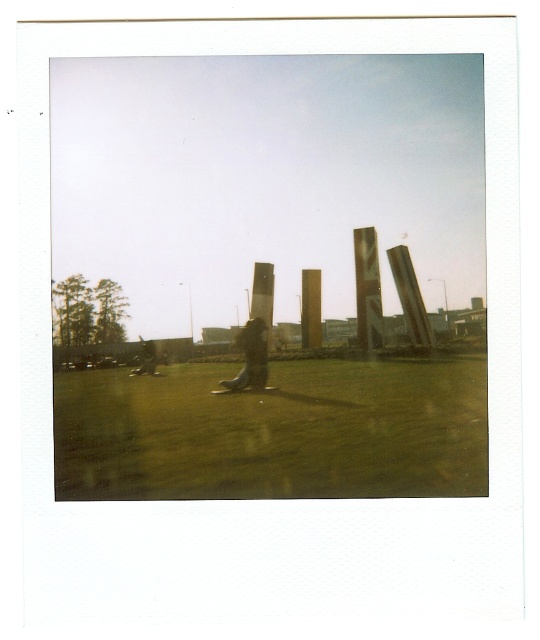
Question: Which point is farther from the camera taking this photo?

Choices:
 (A) (380, 314)
 (B) (315, 280)
 (C) (151, 340)
 (D) (192, 410)

Answer: (C)

Question: Can you confirm if leather boots at center is positioned above gold polished pillar at center?

Choices:
 (A) yes
 (B) no

Answer: (B)

Question: Considering the relative positions of bronze textured pillar at center and matte black jacket at lower left in the image provided, where is bronze textured pillar at center located with respect to matte black jacket at lower left?

Choices:
 (A) right
 (B) left

Answer: (A)

Question: Among these objects, which one is farthest from the camera?

Choices:
 (A) bronze textured pillar at center
 (B) leather boots at center
 (C) gold polished pillar at center

Answer: (C)

Question: Observing the image, what is the correct spatial positioning of green grass at center in reference to gold polished pillar at center?

Choices:
 (A) right
 (B) left

Answer: (B)

Question: Estimate the real-world distances between objects in this image. Which object is closer to the matte black jacket at lower left?

Choices:
 (A) leather boots at center
 (B) bronze textured pillar at center
 (C) green grass at center

Answer: (A)